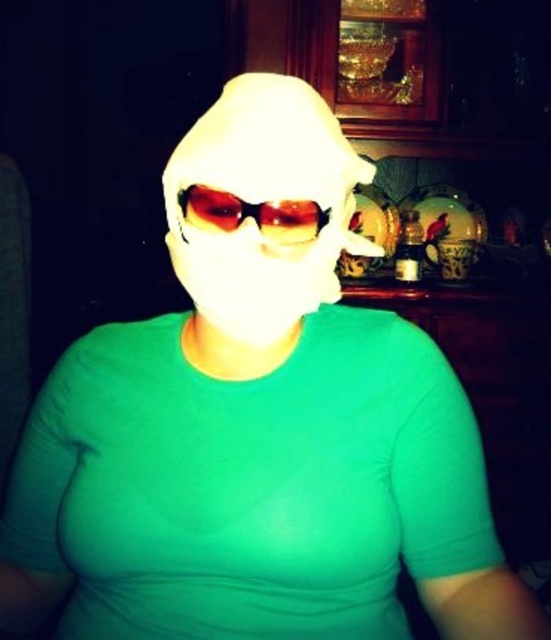
Consider the image. You are a photographer adjusting the lighting for a portrait. The subject is wearing a white matte mask at center. Where is the mask located in the image coordinates?

The white matte mask at center is located at point coordinates (x=262, y=205).

You are a photographer adjusting the lighting for a portrait session. You notice the white matte mask at center and the translucent amber lens goggles at center in the frame. Which object should you focus on first to ensure proper exposure, considering their positions?

The white matte mask at center is closer to the viewer than the translucent amber lens goggles at center, so you should focus on the white matte mask at center first to ensure proper exposure.